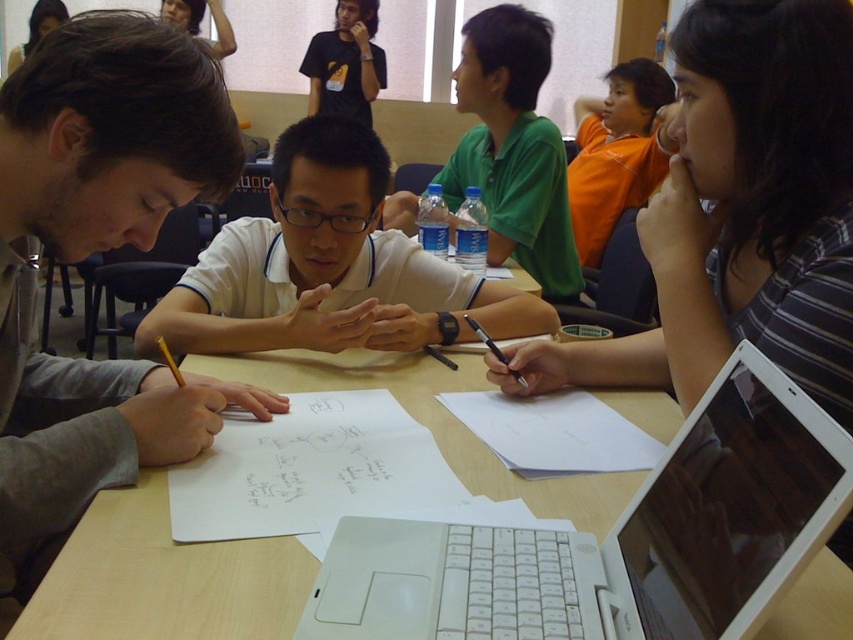
You are part of a team working on a project and need to determine if the orange cotton shirt at upper center can be placed on the white paper at center without folding it. Can it fit?

The orange cotton shirt at upper center is wider than the white paper at center, so it cannot fit without folding.

You are a participant in this collaborative activity. You need to place a small sticker on the object that is smaller between the green matte shirt at center and the white paper at center. Which object should you place the sticker on?

The white paper at center is smaller than the green matte shirt at center, so you should place the sticker on the white paper at center.

You are standing at the entrance of the room and want to locate the orange cotton shirt at upper center. According to the coordinates provided, where should you look relative to the center of the image?

The orange cotton shirt at upper center is located at coordinates point 0.239 on the x axis and 0.723 on the y axis, so you should look slightly to the left and above the center of the image.